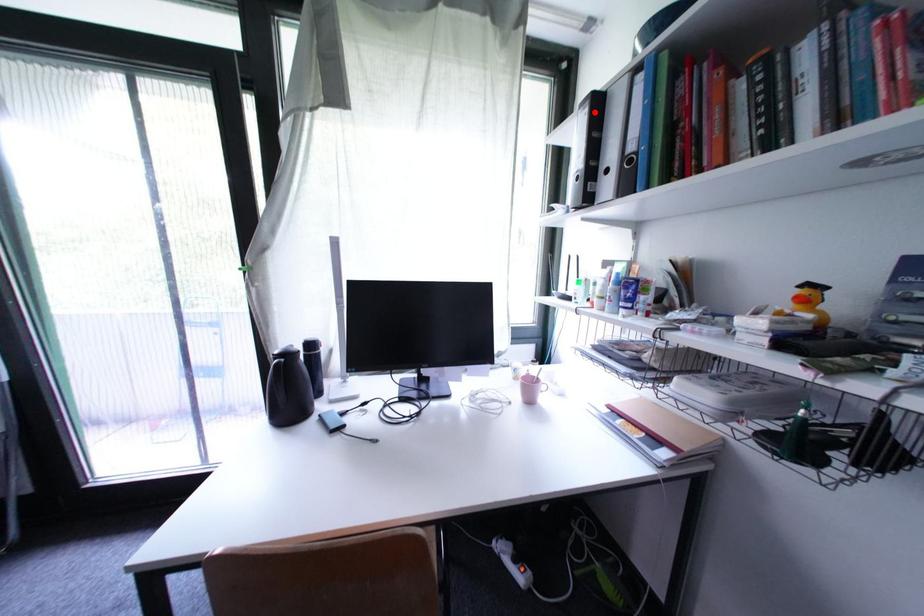
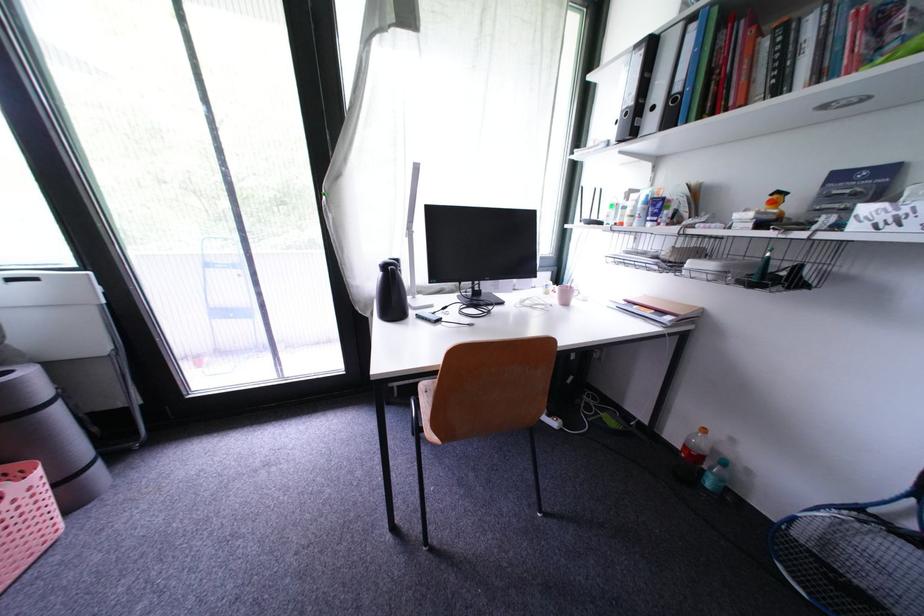
Find the pixel in the second image that matches the highlighted location in the first image.

(650, 54)